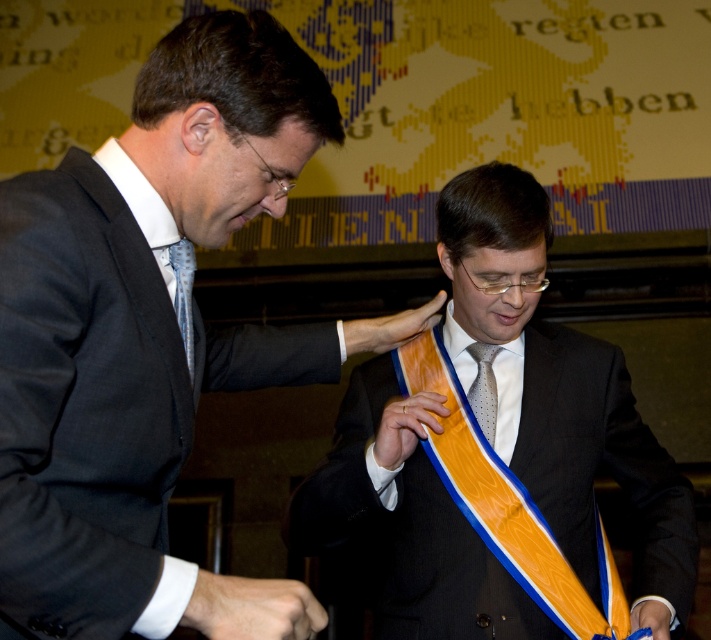
You are a photographer at the event and want to capture a photo where both the blue dotted tie at left and the polka dot silk tie at center are visible. Based on their positions, which tie would appear higher in the photo?

The blue dotted tie at left appears higher in the photo because it is positioned above the polka dot silk tie at center.

You are an event photographer trying to capture a closeup shot of the award ceremony. You want to focus on the matte black suit at center and the orange satin sash at center. Which object should you zoom in on to ensure it takes up more of the frame?

The orange satin sash at center occupies more space than the matte black suit at center, so you should zoom in on the orange satin sash at center to ensure it takes up more of the frame.